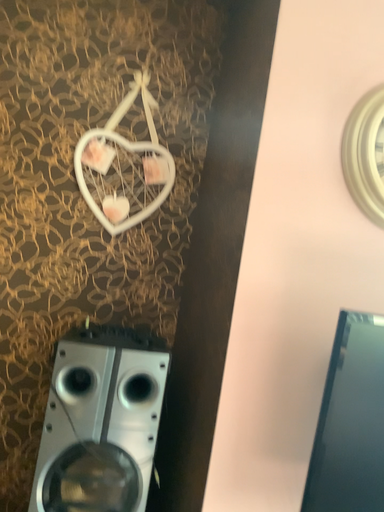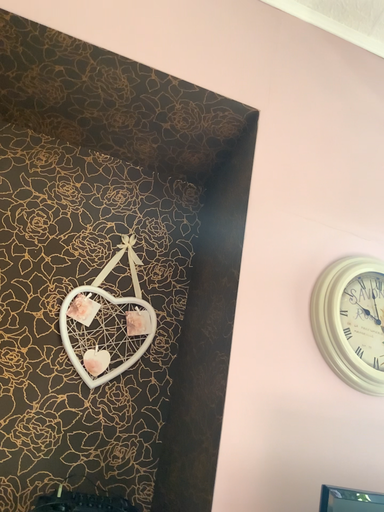
Question: How did the camera likely rotate when shooting the video?

Choices:
 (A) rotated upward
 (B) rotated downward

Answer: (A)